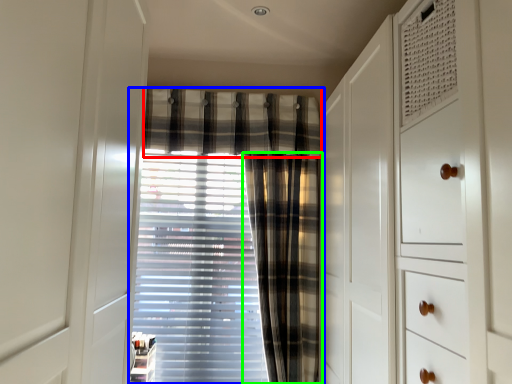
Question: Based on their relative distances, which object is farther from plaid (highlighted by a red box)? Choose from curtain (highlighted by a blue box) and curtain (highlighted by a green box).

Choices:
 (A) curtain
 (B) curtain

Answer: (B)